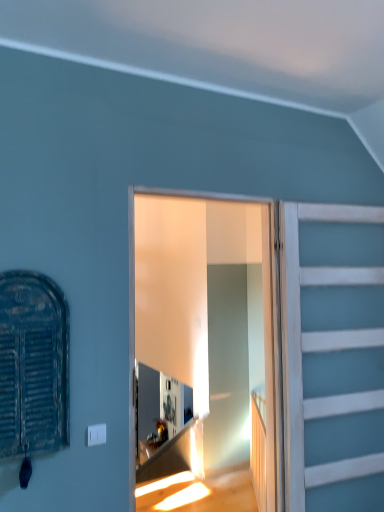
Locate an element on the screen. The height and width of the screenshot is (512, 384). white painted wood at right is located at coordinates (335, 358).

The height and width of the screenshot is (512, 384). I want to click on white painted wood at right, so click(335, 358).

Does rusty metal shutter at left contain clear glass door at center?

That's incorrect, clear glass door at center is not inside rusty metal shutter at left.

Considering the positions of objects rusty metal shutter at left and clear glass door at center in the image provided, who is more to the left, rusty metal shutter at left or clear glass door at center?

rusty metal shutter at left is more to the left.

Is rusty metal shutter at left touching clear glass door at center?

No, rusty metal shutter at left is not making contact with clear glass door at center.

Which of these two, rusty metal shutter at left or clear glass door at center, stands shorter?

rusty metal shutter at left is shorter.

Can you see clear glass door at center touching rusty metal shutter at left?

clear glass door at center is not next to rusty metal shutter at left, and they're not touching.

Can you confirm if clear glass door at center is positioned to the right of rusty metal shutter at left?

Yes, clear glass door at center is to the right of rusty metal shutter at left.

Image resolution: width=384 pixels, height=512 pixels. In order to click on window above the clear glass door at center (from the image's perspective) in this screenshot , I will do (x=33, y=364).

Looking at their sizes, would you say white painted wood at right is wider or thinner than clear glass door at center?

white painted wood at right is wider than clear glass door at center.

Between white painted wood at right and clear glass door at center, which one has larger size?

Bigger between the two is white painted wood at right.

Is white painted wood at right to the left of clear glass door at center from the viewer's perspective?

Incorrect, white painted wood at right is not on the left side of clear glass door at center.

From the image's perspective, is white painted wood at right located above clear glass door at center?

No, from the image's perspective, white painted wood at right is not above clear glass door at center.

Identify the location of garage door located below the rusty metal shutter at left (from the image's perspective). (335, 358).

Between rusty metal shutter at left and white painted wood at right, which one appears on the left side from the viewer's perspective?

Positioned to the left is rusty metal shutter at left.

Is rusty metal shutter at left in front of white painted wood at right?

Yes, rusty metal shutter at left is closer to the viewer.

Could you tell me if rusty metal shutter at left is turned towards white painted wood at right?

No, rusty metal shutter at left is not aimed at white painted wood at right.

From a real-world perspective, is clear glass door at center physically located above or below white painted wood at right?

clear glass door at center is above white painted wood at right.

Considering the sizes of objects clear glass door at center and white painted wood at right in the image provided, who is wider, clear glass door at center or white painted wood at right?

Wider between the two is white painted wood at right.

In the image, is clear glass door at center on the left side or the right side of white painted wood at right?

clear glass door at center is to the left of white painted wood at right.

Is the position of clear glass door at center more distant than that of white painted wood at right?

No, clear glass door at center is closer to the camera.

Is point (365, 398) in front of point (36, 426)?

No, (365, 398) is behind (36, 426).

Is white painted wood at right not inside rusty metal shutter at left?

Yes, white painted wood at right is not within rusty metal shutter at left.

From their relative heights in the image, would you say white painted wood at right is taller or shorter than rusty metal shutter at left?

white painted wood at right is taller than rusty metal shutter at left.

Locate an element on the screen. The image size is (384, 512). window above the white painted wood at right (from the image's perspective) is located at coordinates coord(33,364).

At what (x,y) coordinates should I click in order to perform the action: click on window frame behind the rusty metal shutter at left. Please return your answer as a coordinate pair (x, y). This screenshot has width=384, height=512. Looking at the image, I should click on (199, 294).

You are a GUI agent. You are given a task and a screenshot of the screen. Output one action in this format:
    pyautogui.click(x=<x>, y=<y>)
    Task: Click on the window located above the clear glass door at center (from a real-world perspective)
    
    Given the screenshot: What is the action you would take?
    pyautogui.click(x=33, y=364)

Looking at the image, which one is located further to rusty metal shutter at left, white painted wood at right or clear glass door at center?

The object further to rusty metal shutter at left is clear glass door at center.

When comparing their distances from white painted wood at right, does clear glass door at center or rusty metal shutter at left seem closer?

Result: The object closer to white painted wood at right is clear glass door at center.

Looking at the image, which one is located closer to clear glass door at center, rusty metal shutter at left or white painted wood at right?

white painted wood at right lies closer to clear glass door at center than the other object.

From the image, which object appears to be nearer to rusty metal shutter at left, clear glass door at center or white painted wood at right?

white painted wood at right lies closer to rusty metal shutter at left than the other object.

Which object lies nearer to the anchor point clear glass door at center, white painted wood at right or rusty metal shutter at left?

white painted wood at right.

Looking at the image, which one is located closer to white painted wood at right, rusty metal shutter at left or clear glass door at center?

clear glass door at center is closer to white painted wood at right.

The height and width of the screenshot is (512, 384). I want to click on window frame situated between rusty metal shutter at left and white painted wood at right from left to right, so click(199, 294).